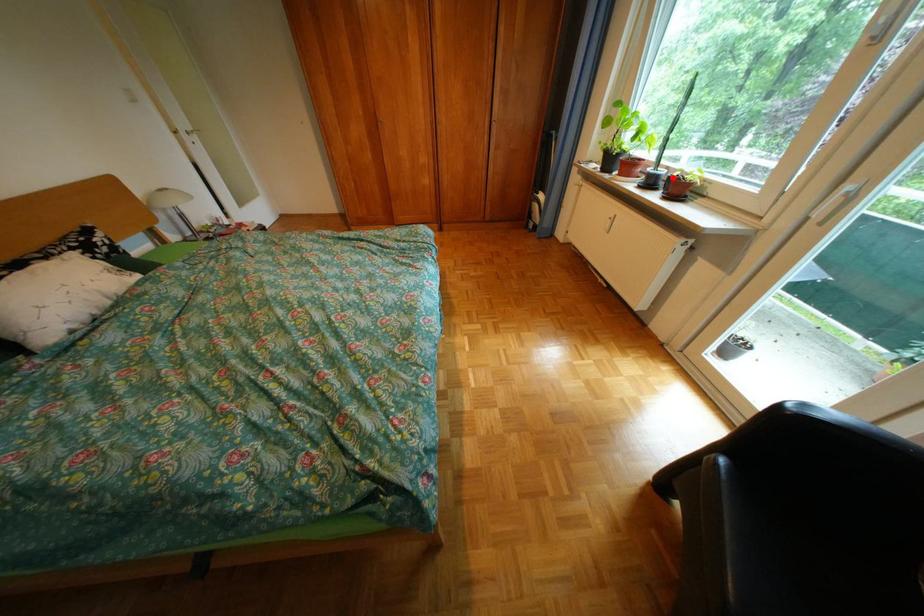
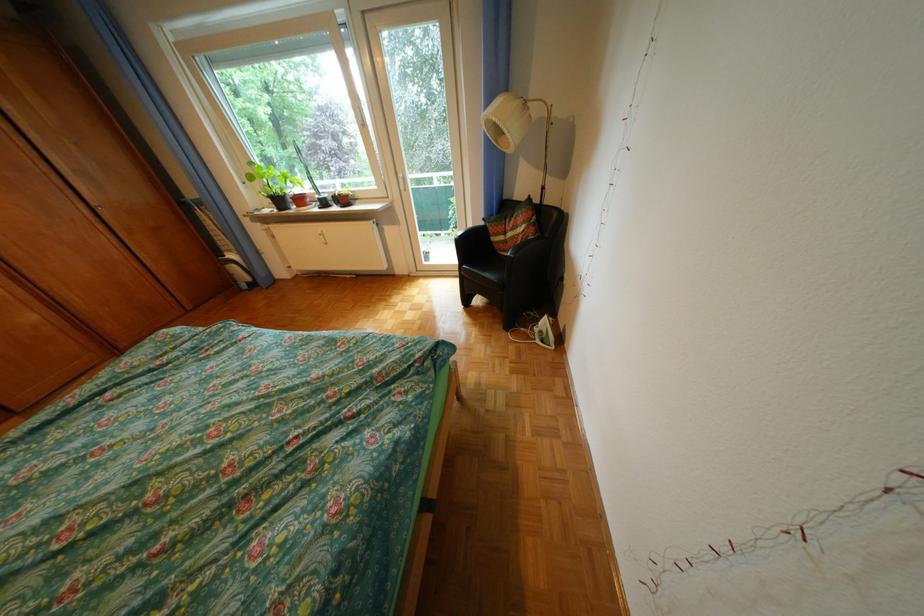
Question: I am providing you with two images of the same scene from different viewpoints. Given a red point in image1, look at the same physical point in image2. Is it:

Choices:
 (A) Closer to the viewpoint
 (B) Farther from the viewpoint

Answer: (A)